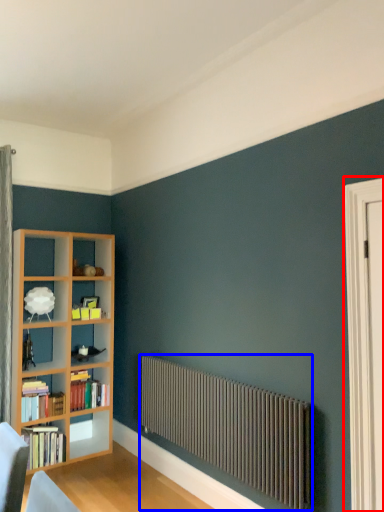
Question: Among these objects, which one is nearest to the camera, screen door (highlighted by a red box) or radiator (highlighted by a blue box)?

Choices:
 (A) screen door
 (B) radiator

Answer: (A)